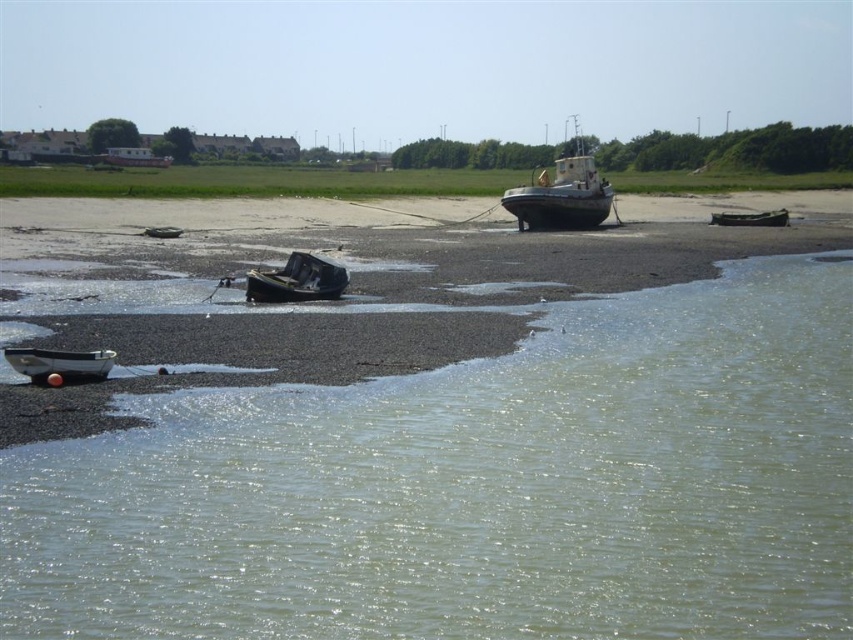
Question: Which object is closer to the camera taking this photo?

Choices:
 (A) smooth gray boat at center
 (B) wooden boat at lower right
 (C) white matte boat at lower left
 (D) clear water at lower left

Answer: (D)

Question: Is rusty metal boat at center closer to the viewer compared to white matte boat at lower left?

Choices:
 (A) no
 (B) yes

Answer: (A)

Question: Considering the real-world distances, which object is farthest from the wooden boat at lower right?

Choices:
 (A) smooth gray boat at center
 (B) white matte boat at lower left
 (C) wooden boat at center

Answer: (B)

Question: Does smooth gray boat at center appear on the left side of rusty metal boat at center?

Choices:
 (A) yes
 (B) no

Answer: (B)

Question: Among these objects, which one is farthest from the camera?

Choices:
 (A) smooth gray boat at center
 (B) rusty metal boat at center
 (C) wooden boat at center
 (D) clear water at lower left

Answer: (A)

Question: Does smooth gray boat at center have a lesser width compared to white matte boat at lower left?

Choices:
 (A) no
 (B) yes

Answer: (A)